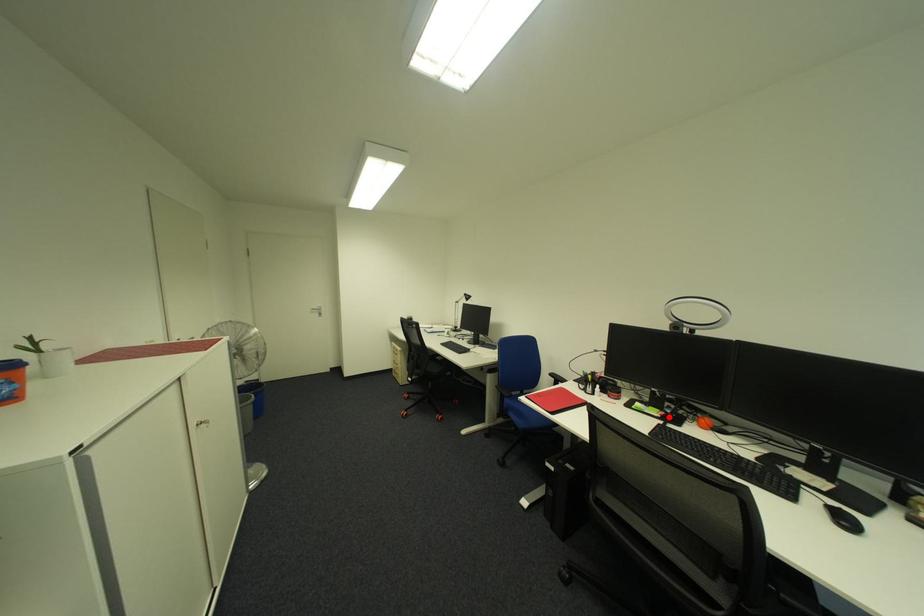
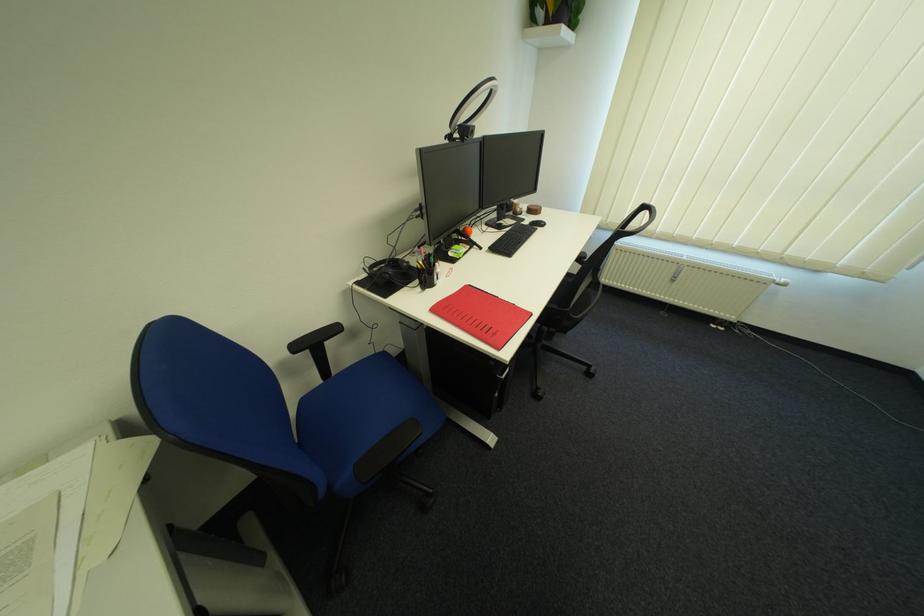
The point at the highlighted location is marked in the first image. Where is the corresponding point in the second image?

(479, 248)